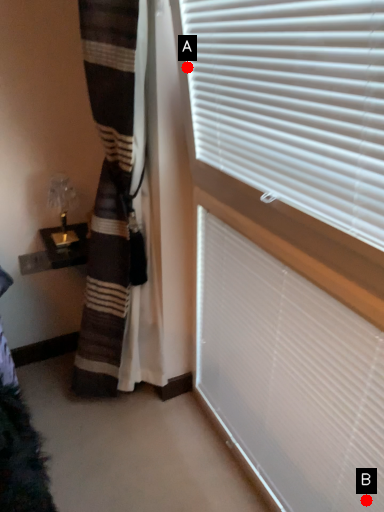
Question: Two points are circled on the image, labeled by A and B beside each circle. Among these points, which one is nearest to the camera?

Choices:
 (A) A is closer
 (B) B is closer

Answer: (B)